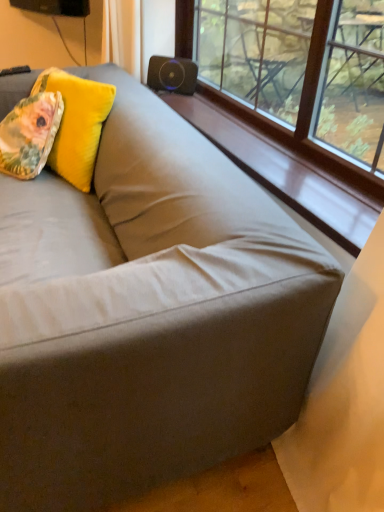
Question: Is fluffy yellow pillow at upper left, which appears as the 1th throw pillow when viewed from the back, not near floral fabric pillow at upper left, the first throw pillow in the front-to-back sequence?

Choices:
 (A) yes
 (B) no

Answer: (B)

Question: Is fluffy yellow pillow at upper left, the second throw pillow viewed from the front, located outside floral fabric pillow at upper left, the 2th throw pillow when ordered from back to front?

Choices:
 (A) no
 (B) yes

Answer: (B)

Question: Is floral fabric pillow at upper left, the 2th throw pillow when ordered from back to front, surrounded by fluffy yellow pillow at upper left, which appears as the 1th throw pillow when viewed from the back?

Choices:
 (A) no
 (B) yes

Answer: (A)

Question: From the image's perspective, does fluffy yellow pillow at upper left, the second throw pillow viewed from the front, appear higher than floral fabric pillow at upper left, the first throw pillow in the front-to-back sequence?

Choices:
 (A) yes
 (B) no

Answer: (A)

Question: From a real-world perspective, does fluffy yellow pillow at upper left, which appears as the 1th throw pillow when viewed from the back, stand above floral fabric pillow at upper left, the 2th throw pillow when ordered from back to front?

Choices:
 (A) no
 (B) yes

Answer: (B)

Question: From a real-world perspective, relative to black matte speaker at upper center, is fluffy yellow pillow at upper left, the second throw pillow viewed from the front, vertically above or below?

Choices:
 (A) below
 (B) above

Answer: (A)

Question: In terms of width, does fluffy yellow pillow at upper left, which appears as the 1th throw pillow when viewed from the back, look wider or thinner when compared to black matte speaker at upper center?

Choices:
 (A) thin
 (B) wide

Answer: (B)

Question: Looking at the image, does fluffy yellow pillow at upper left, the second throw pillow viewed from the front, seem bigger or smaller compared to black matte speaker at upper center?

Choices:
 (A) small
 (B) big

Answer: (B)

Question: Based on their positions, is fluffy yellow pillow at upper left, which appears as the 1th throw pillow when viewed from the back, located to the left or right of black matte speaker at upper center?

Choices:
 (A) left
 (B) right

Answer: (A)

Question: Is wooden at upper center in front of or behind fluffy yellow pillow at upper left, which appears as the 1th throw pillow when viewed from the back, in the image?

Choices:
 (A) behind
 (B) front

Answer: (B)

Question: In terms of height, does wooden at upper center look taller or shorter compared to fluffy yellow pillow at upper left, the second throw pillow viewed from the front?

Choices:
 (A) short
 (B) tall

Answer: (A)

Question: Looking at their shapes, would you say wooden at upper center is wider or thinner than fluffy yellow pillow at upper left, the second throw pillow viewed from the front?

Choices:
 (A) thin
 (B) wide

Answer: (B)

Question: From a real-world perspective, relative to fluffy yellow pillow at upper left, which appears as the 1th throw pillow when viewed from the back, is wooden at upper center vertically above or below?

Choices:
 (A) above
 (B) below

Answer: (B)

Question: Visually, is black matte speaker at upper center positioned to the left or to the right of floral fabric pillow at upper left, the 2th throw pillow when ordered from back to front?

Choices:
 (A) left
 (B) right

Answer: (B)

Question: From their relative heights in the image, would you say black matte speaker at upper center is taller or shorter than floral fabric pillow at upper left, the first throw pillow in the front-to-back sequence?

Choices:
 (A) short
 (B) tall

Answer: (A)